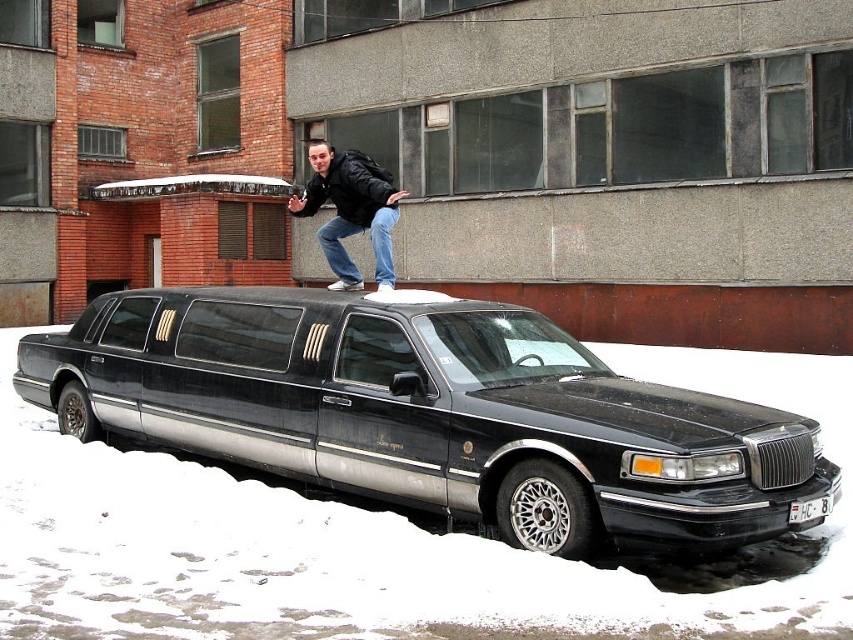
Question: Which point appears closest to the camera in this image?

Choices:
 (A) click(x=363, y=225)
 (B) click(x=257, y=401)

Answer: (B)

Question: Which point is farther to the camera?

Choices:
 (A) (746, 435)
 (B) (799, 513)

Answer: (B)

Question: Can you confirm if black metallic limousine at center is positioned below white plastic license plate at center?

Choices:
 (A) no
 (B) yes

Answer: (A)

Question: Does leather jacket at center lie in front of white plastic license plate at center?

Choices:
 (A) no
 (B) yes

Answer: (A)

Question: Is the position of black metallic limousine at center more distant than that of leather jacket at center?

Choices:
 (A) yes
 (B) no

Answer: (B)

Question: Which object appears farthest from the camera in this image?

Choices:
 (A) leather jacket at center
 (B) black metallic limousine at center

Answer: (A)